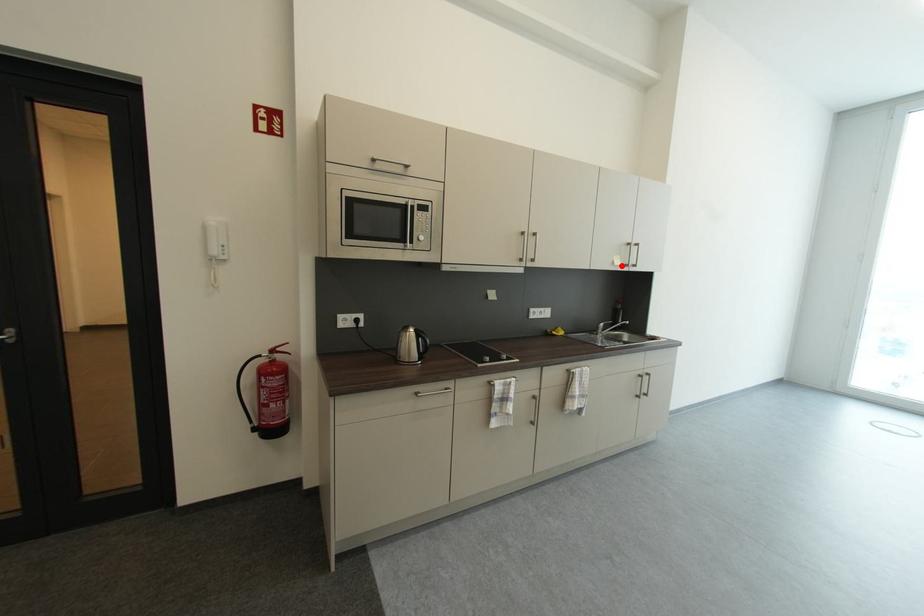
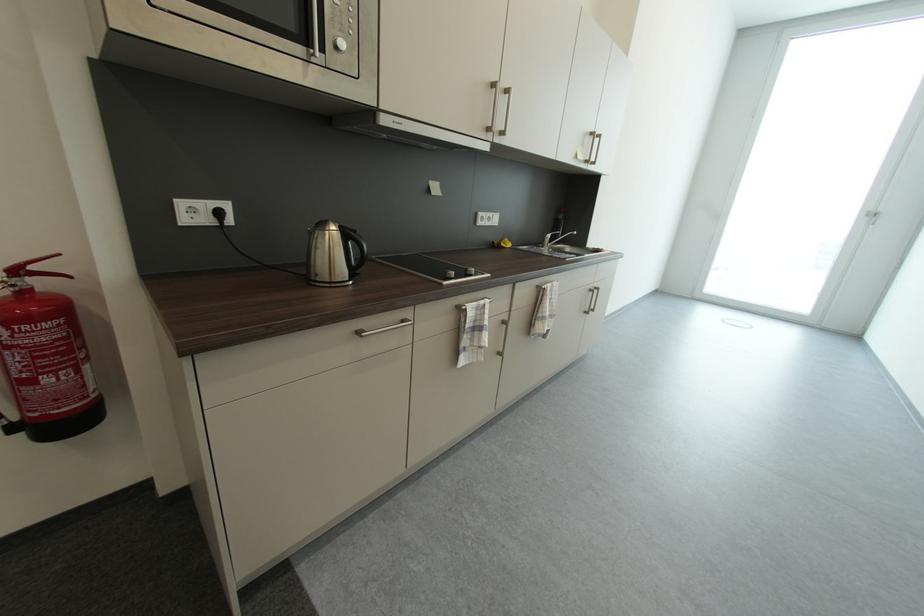
Locate, in the second image, the point that corresponds to the highlighted location in the first image.

(585, 160)